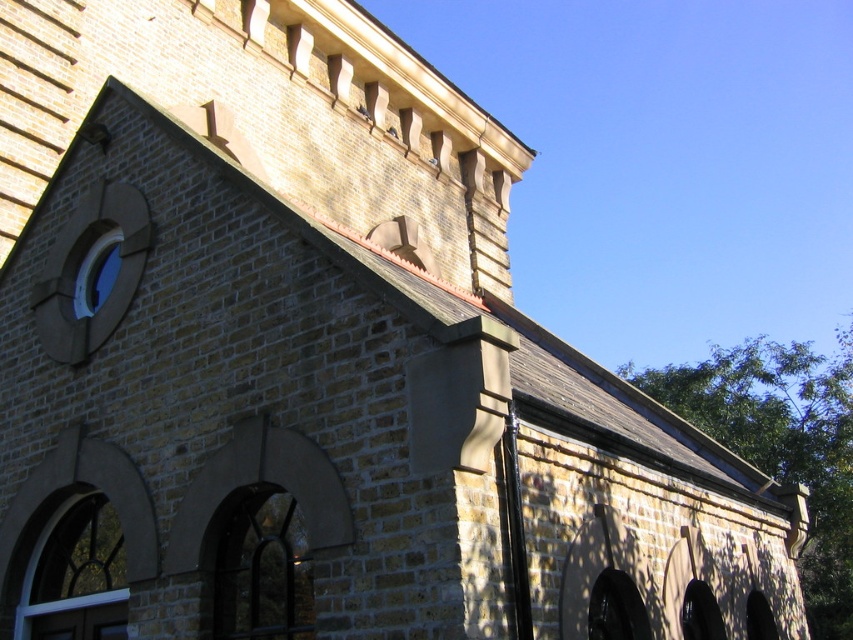
Question: Which object is positioned farthest from the stained glass window at lower left?

Choices:
 (A) transparent glass window at upper left
 (B) dark glass window at lower center

Answer: (A)

Question: Is dark glass window at lower center closer to camera compared to transparent glass window at upper left?

Choices:
 (A) no
 (B) yes

Answer: (B)

Question: Can you confirm if stained glass window at lower left is positioned below transparent glass window at upper left?

Choices:
 (A) no
 (B) yes

Answer: (B)

Question: Does dark glass window at lower center appear on the right side of transparent glass window at upper left?

Choices:
 (A) yes
 (B) no

Answer: (A)

Question: Which point is farther from the camera taking this photo?

Choices:
 (A) (215, 625)
 (B) (102, 300)

Answer: (B)

Question: Which object is farther from the camera taking this photo?

Choices:
 (A) transparent glass window at upper left
 (B) stained glass window at lower left
 (C) dark glass window at lower center

Answer: (A)